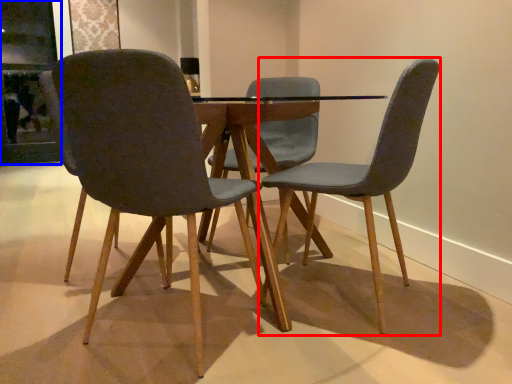
Question: Which point is further to the camera, chair (highlighted by a red box) or glass door (highlighted by a blue box)?

Choices:
 (A) chair
 (B) glass door

Answer: (B)